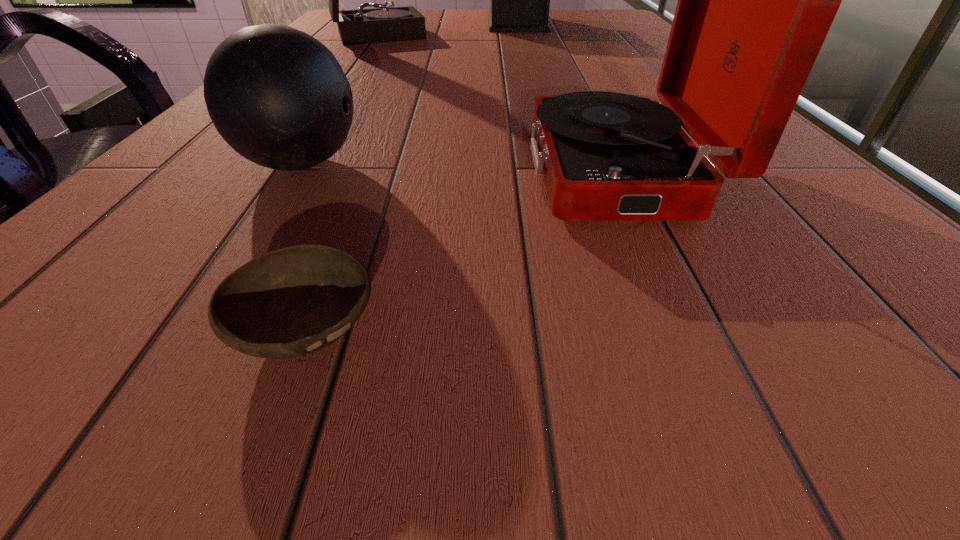
The height and width of the screenshot is (540, 960). Find the location of `the tallest phonograph_record`. the tallest phonograph_record is located at coordinates (520, 0).

Find the location of a particular element. This screenshot has height=540, width=960. the leftmost phonograph_record is located at coordinates (362, 26).

Locate an element on the screen. The image size is (960, 540). the nearest phonograph_record is located at coordinates (756, 0).

The image size is (960, 540). Identify the location of the second shortest object. (278, 96).

The width and height of the screenshot is (960, 540). I want to click on the nearest object, so (x=290, y=302).

The height and width of the screenshot is (540, 960). Identify the location of bowl. (290, 302).

Where is `vacant point located at the horn opening of the tallest object`? This screenshot has width=960, height=540. vacant point located at the horn opening of the tallest object is located at coordinates [x=454, y=24].

Identify the location of vacant point located at the horn opening of the tallest object. (468, 24).

At what (x,y) coordinates should I click in order to perform the action: click on vacant area situated 0.220m at the horn opening of the tallest object. Please return your answer as a coordinate pair (x, y). The image size is (960, 540). Looking at the image, I should click on (413, 24).

Where is `vacant space situated 0.210m on the front of the leftmost phonograph_record`? The height and width of the screenshot is (540, 960). vacant space situated 0.210m on the front of the leftmost phonograph_record is located at coordinates (353, 72).